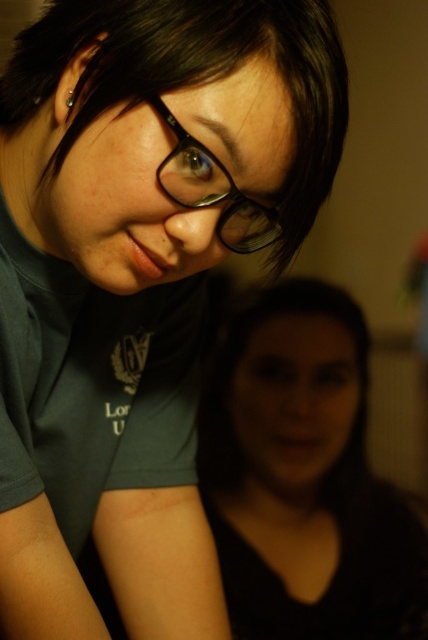
Can you confirm if black matte hair at lower center is positioned to the right of black matte glasses at upper center?

Indeed, black matte hair at lower center is positioned on the right side of black matte glasses at upper center.

This screenshot has height=640, width=428. Identify the location of black matte hair at lower center. (305, 477).

Does point (249, 401) come farther from viewer compared to point (261, 220)?

Yes, it is.

You are a GUI agent. You are given a task and a screenshot of the screen. Output one action in this format:
    pyautogui.click(x=<x>, y=<y>)
    Task: Click on the black matte hair at lower center
    The width and height of the screenshot is (428, 640).
    Given the screenshot: What is the action you would take?
    pyautogui.click(x=305, y=477)